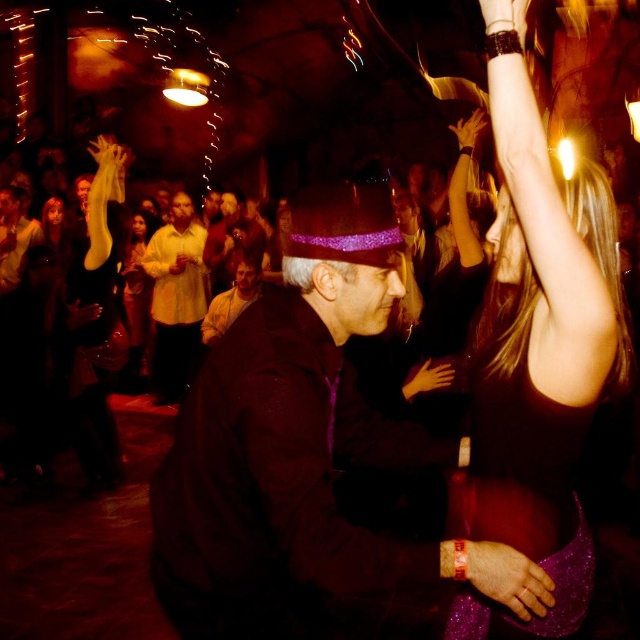
Question: Which of the following is the closest to the observer?

Choices:
 (A) (445, 380)
 (B) (134, 301)
 (C) (173, 262)
 (D) (109, 145)

Answer: (A)

Question: Does sparkly purple dress at right appear on the right side of matte yellow dress at center?

Choices:
 (A) yes
 (B) no

Answer: (A)

Question: Which object appears closest to the camera in this image?

Choices:
 (A) white matte cup at upper center
 (B) matte yellow dress at center

Answer: (A)

Question: Which object is the closest to the light yellow shirt at center?

Choices:
 (A) black sparkly dress at upper right
 (B) purple velvet hat at center

Answer: (B)

Question: Considering the relative positions of sparkly purple wristband at lower center and white matte hand at upper right in the image provided, where is sparkly purple wristband at lower center located with respect to white matte hand at upper right?

Choices:
 (A) below
 (B) above

Answer: (A)

Question: Can you confirm if sparkly purple dress at right is wider than white matte cup at upper center?

Choices:
 (A) yes
 (B) no

Answer: (A)